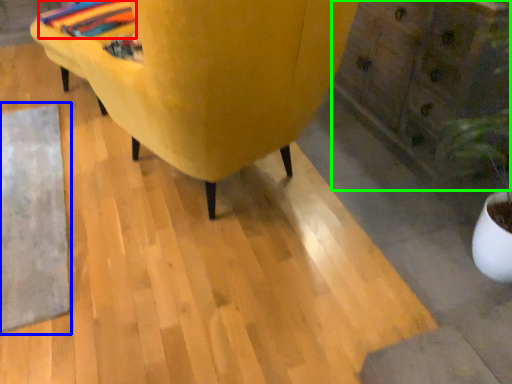
Question: Which object is the farthest from blanket (highlighted by a red box)? Choose among these: mat (highlighted by a blue box) or dresser (highlighted by a green box).

Choices:
 (A) mat
 (B) dresser

Answer: (B)